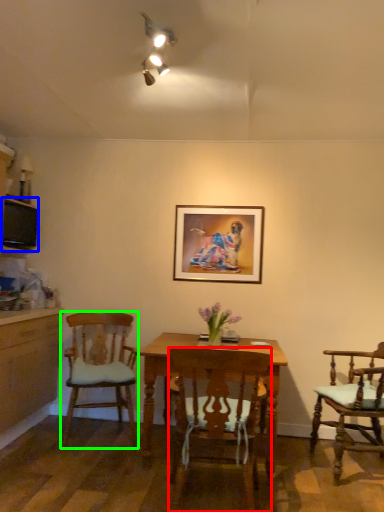
Question: Based on their relative distances, which object is nearer to chair (highlighted by a red box)? Choose from television (highlighted by a blue box) and chair (highlighted by a green box).

Choices:
 (A) television
 (B) chair

Answer: (B)